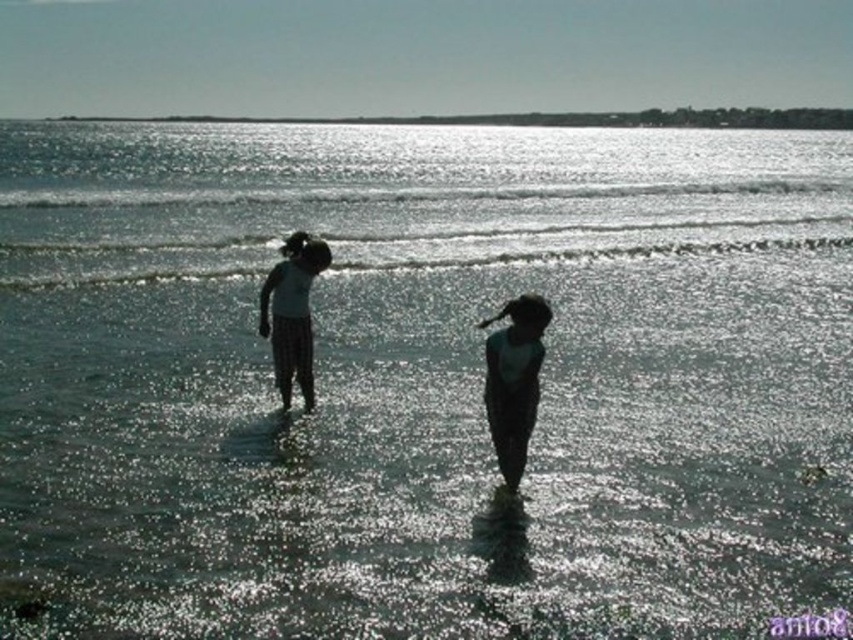
Question: Among these points, which one is farthest from the camera?

Choices:
 (A) (299, 312)
 (B) (277, 308)

Answer: (B)

Question: Is silhouette fabric children at center to the right of matte green shirt at center from the viewer's perspective?

Choices:
 (A) no
 (B) yes

Answer: (B)

Question: Which of the following is the farthest from the observer?

Choices:
 (A) (514, 440)
 (B) (492, 428)

Answer: (B)

Question: Does silhouette fabric children at center appear under matte green shirt at center?

Choices:
 (A) yes
 (B) no

Answer: (A)

Question: Which object is positioned closest to the matte white shirt at center?

Choices:
 (A) matte green shirt at center
 (B) silhouette fabric children at center

Answer: (A)

Question: Does silhouette fabric children at center appear on the right side of matte green shirt at center?

Choices:
 (A) yes
 (B) no

Answer: (A)